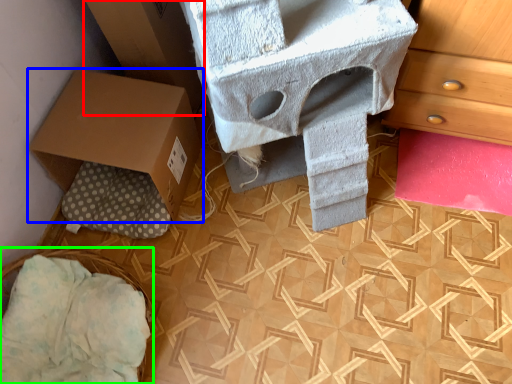
Question: Which object is the farthest from cardboard box (highlighted by a red box)? Choose among these: box (highlighted by a blue box) or basket (highlighted by a green box).

Choices:
 (A) box
 (B) basket

Answer: (B)